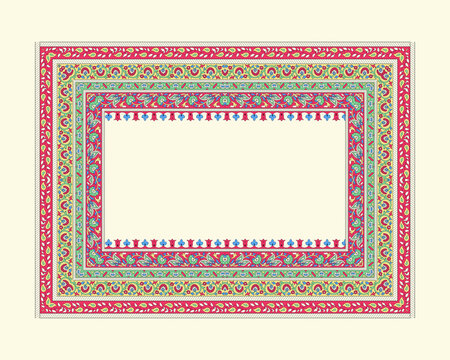
Find the location of a particular element. The image size is (450, 360). outside edge of rug is located at coordinates (217, 317), (37, 225), (124, 44), (415, 80).